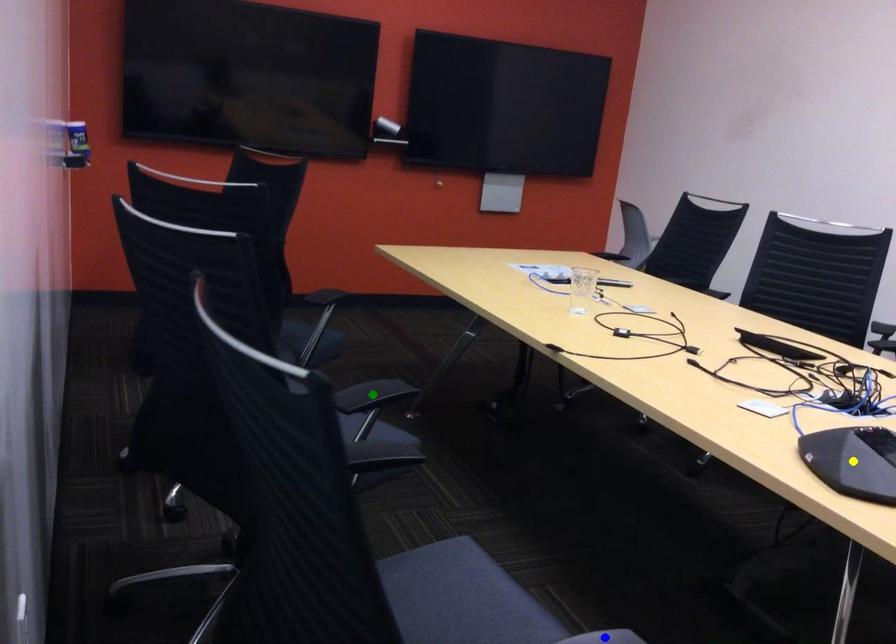
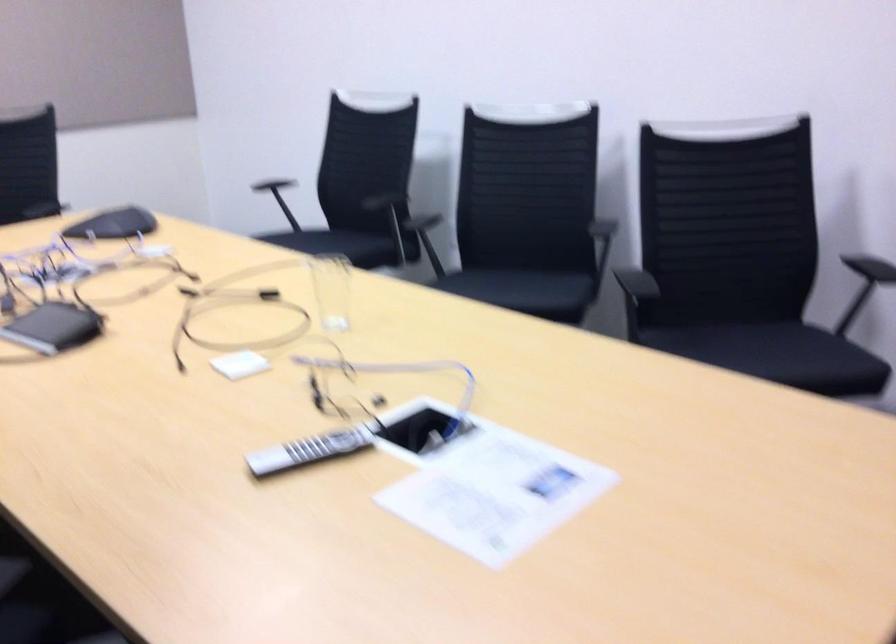
I am providing you with two images of the same scene from different viewpoints. Three points are marked in image1. Which point corresponds to a part or object that is occluded in image2?In image1, three points are marked. Which of them correspond to a part or object that is occluded in image2?Among the three points shown in image1, which one corresponds to a part or object that is no longer visible due to occlusion in image2?

blue point, yellow point, green point cannot be seen in image2.